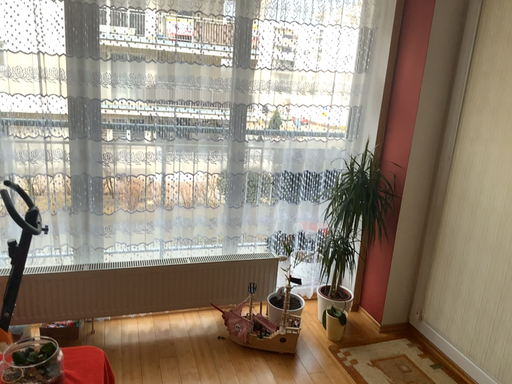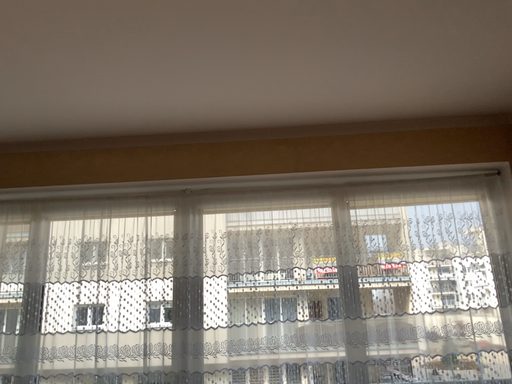
Question: Which way did the camera rotate in the video?

Choices:
 (A) rotated downward
 (B) rotated upward

Answer: (B)